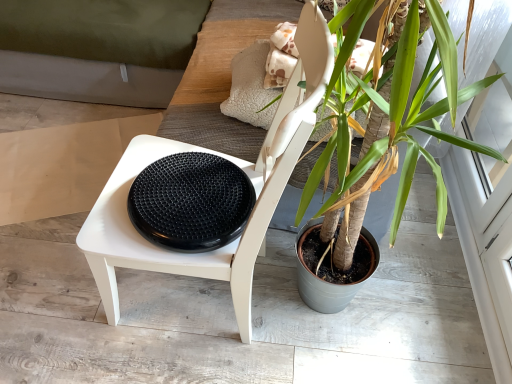
This screenshot has width=512, height=384. In order to click on black rubber footrest at center in this screenshot , I will do `click(191, 202)`.

What is the approximate width of white matte chair at center?

21.77 inches.

Measure the distance between point (355, 87) and camera.

A distance of 1.03 meters exists between point (355, 87) and camera.

Where is `black rubber footrest at center`? Image resolution: width=512 pixels, height=384 pixels. black rubber footrest at center is located at coordinates (191, 202).

Is the depth of green leafy plant at center greater than that of black rubber footrest at center?

No, green leafy plant at center is closer to the camera.

Considering the sizes of objects green leafy plant at center and black rubber footrest at center in the image provided, who is thinner, green leafy plant at center or black rubber footrest at center?

black rubber footrest at center is thinner.

Is green leafy plant at center far from black rubber footrest at center?

No, there isn't a large distance between green leafy plant at center and black rubber footrest at center.

Is black rubber footrest at center a part of green leafy plant at center?

No, black rubber footrest at center is located outside of green leafy plant at center.

Could you tell me if black rubber footrest at center is facing white matte chair at center?

Yes, black rubber footrest at center is oriented towards white matte chair at center.

Who is taller, black rubber footrest at center or white matte chair at center?

white matte chair at center.

From a real-world perspective, is black rubber footrest at center located beneath white matte chair at center?

No, from a real-world perspective, black rubber footrest at center is not below white matte chair at center.

Which is more to the left, black rubber footrest at center or white matte chair at center?

black rubber footrest at center is more to the left.

Does black rubber footrest at center lie behind green leafy plant at center?

Yes, it is.

Is black rubber footrest at center touching green leafy plant at center?

No.

Which object is positioned more to the left, black rubber footrest at center or green leafy plant at center?

From the viewer's perspective, black rubber footrest at center appears more on the left side.

Considering the relative sizes of green leafy plant at center and white matte chair at center in the image provided, is green leafy plant at center bigger than white matte chair at center?

Yes, green leafy plant at center is bigger than white matte chair at center.

Looking at this image, considering the positions of objects green leafy plant at center and white matte chair at center in the image provided, who is behind, green leafy plant at center or white matte chair at center?

green leafy plant at center is further away from the camera.

Is green leafy plant at center at the right side of white matte chair at center?

Correct, you'll find green leafy plant at center to the right of white matte chair at center.

Considering the relative sizes of green leafy plant at center and white matte chair at center in the image provided, is green leafy plant at center thinner than white matte chair at center?

Incorrect, the width of green leafy plant at center is not less than that of white matte chair at center.

Between point (128, 185) and point (236, 226), which one is positioned behind?

The point (128, 185) is farther from the camera.

Is white matte chair at center oriented towards black rubber footrest at center?

Yes, white matte chair at center is facing black rubber footrest at center.

From a real-world perspective, is white matte chair at center located higher than black rubber footrest at center?

Incorrect, from a real-world perspective, white matte chair at center is lower than black rubber footrest at center.

Is white matte chair at center not near black rubber footrest at center?

white matte chair at center is near black rubber footrest at center, not far away.

Considering the positions of objects white matte chair at center and green leafy plant at center in the image provided, who is more to the left, white matte chair at center or green leafy plant at center?

white matte chair at center is more to the left.

Is white matte chair at center not close to green leafy plant at center?

Actually, white matte chair at center and green leafy plant at center are a little close together.

Considering the relative sizes of white matte chair at center and green leafy plant at center in the image provided, is white matte chair at center taller than green leafy plant at center?

Incorrect, the height of white matte chair at center is not larger of that of green leafy plant at center.

How many degrees apart are the facing directions of white matte chair at center and green leafy plant at center?

93 degrees separate the facing orientations of white matte chair at center and green leafy plant at center.

Find the location of a particular element. footrest below the green leafy plant at center (from the image's perspective) is located at coordinates (191, 202).

The image size is (512, 384). I want to click on footrest on the left of white matte chair at center, so click(191, 202).

Looking at the image, which one is located closer to black rubber footrest at center, green leafy plant at center or white matte chair at center?

white matte chair at center.

Based on their spatial positions, is black rubber footrest at center or green leafy plant at center further from white matte chair at center?

The object further to white matte chair at center is green leafy plant at center.

Estimate the real-world distances between objects in this image. Which object is further from black rubber footrest at center, white matte chair at center or green leafy plant at center?

Based on the image, green leafy plant at center appears to be further to black rubber footrest at center.

Which object lies further to the anchor point white matte chair at center, green leafy plant at center or black rubber footrest at center?

green leafy plant at center lies further to white matte chair at center than the other object.

When comparing their distances from green leafy plant at center, does black rubber footrest at center or white matte chair at center seem further?

black rubber footrest at center.

Based on their spatial positions, is white matte chair at center or black rubber footrest at center closer to green leafy plant at center?

The object closer to green leafy plant at center is white matte chair at center.

Locate an element on the screen. footrest between green leafy plant at center and white matte chair at center from top to bottom is located at coordinates (191, 202).